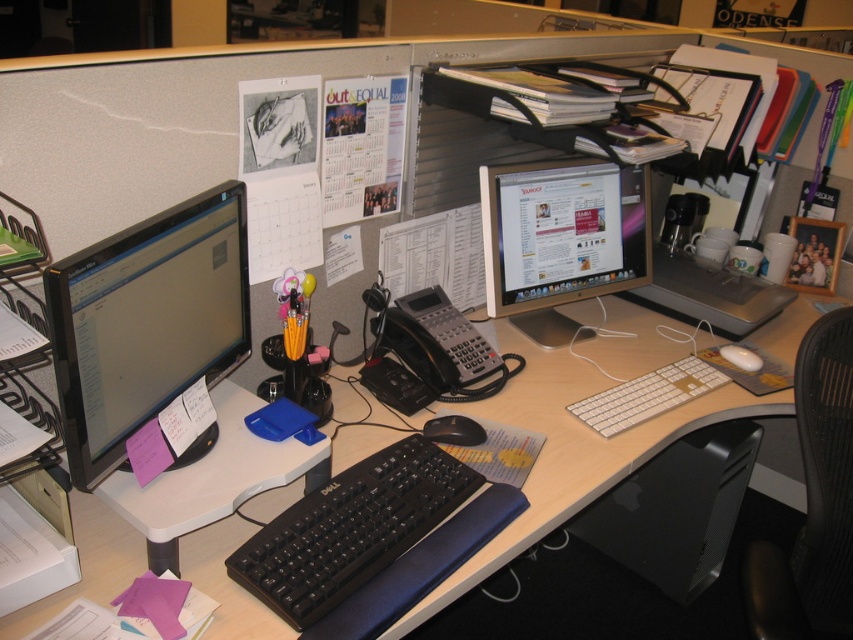
Measure the distance between matte black monitor at left and white plastic keyboard at center.

matte black monitor at left and white plastic keyboard at center are 33.27 inches apart from each other.

Who is lower down, matte black monitor at left or white plastic keyboard at center?

Positioned lower is white plastic keyboard at center.

Between point (134, 256) and point (670, 388), which one is positioned in front?

Positioned in front is point (134, 256).

Find the location of a particular element. The width and height of the screenshot is (853, 640). matte black monitor at left is located at coordinates (146, 323).

Which is behind, point (503, 316) or point (746, 353)?

The point (746, 353) is more distant.

The width and height of the screenshot is (853, 640). Find the location of `satin silver monitor at center`. satin silver monitor at center is located at coordinates (561, 240).

Is black plastic keyboard at center further to camera compared to white matte mouse at center?

No.

Does black plastic keyboard at center have a lesser height compared to white matte mouse at center?

Incorrect, black plastic keyboard at center's height does not fall short of white matte mouse at center's.

Does point (270, 552) come behind point (737, 362)?

No, (270, 552) is closer to viewer.

Identify the location of black plastic keyboard at center. (314, 520).